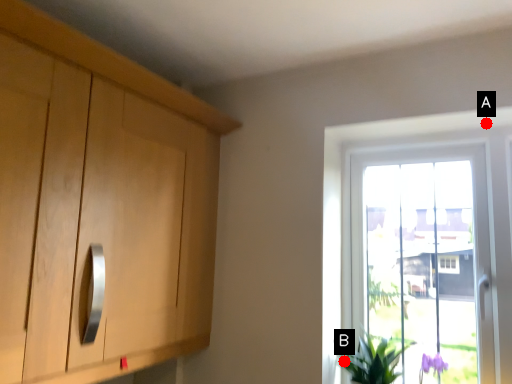
Question: Two points are circled on the image, labeled by A and B beside each circle. Which of the following is the farthest from the observer?

Choices:
 (A) A is further
 (B) B is further

Answer: (A)